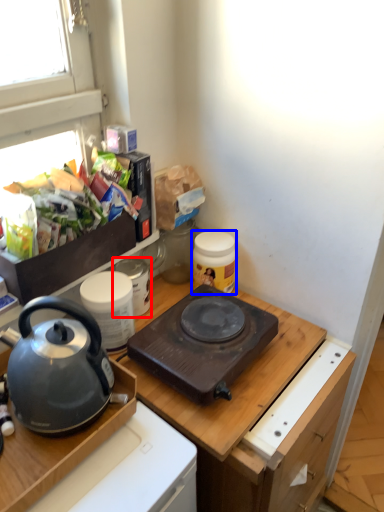
Question: Which object appears closest to the camera in this image, appliance (highlighted by a red box) or kitchen appliance (highlighted by a blue box)?

Choices:
 (A) appliance
 (B) kitchen appliance

Answer: (A)